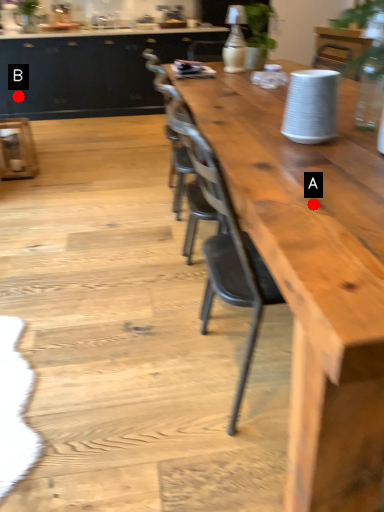
Question: Two points are circled on the image, labeled by A and B beside each circle. Which point is farther to the camera?

Choices:
 (A) A is further
 (B) B is further

Answer: (B)